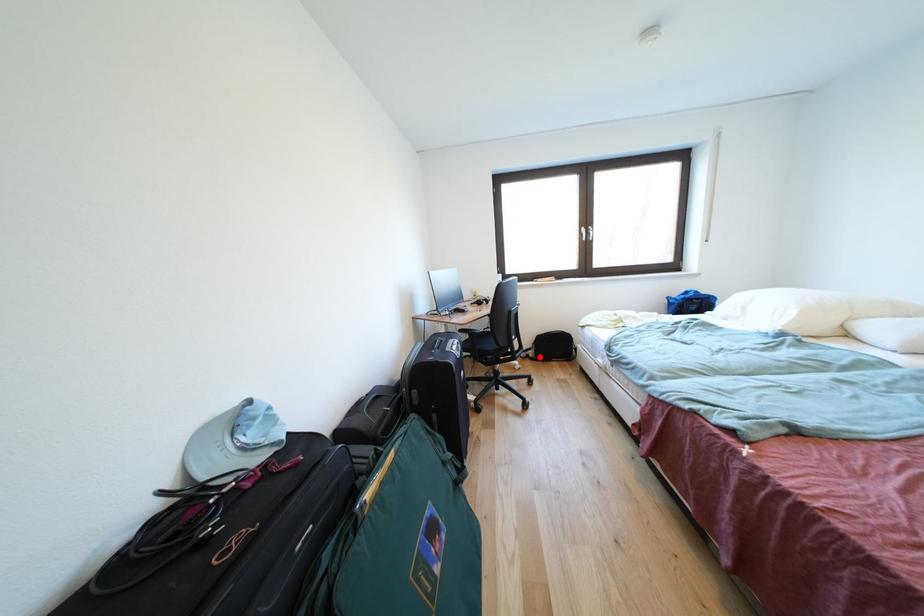
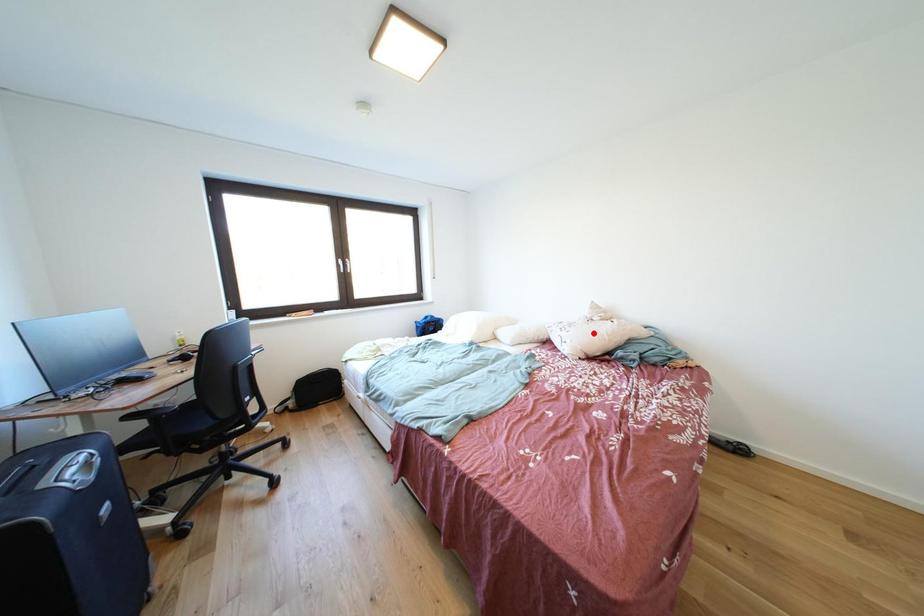
I am providing you with two images of the same scene from different viewpoints. A red point is marked on the first image and another point is marked on the second image. Do the highlighted points in image1 and image2 indicate the same real-world spot?

No